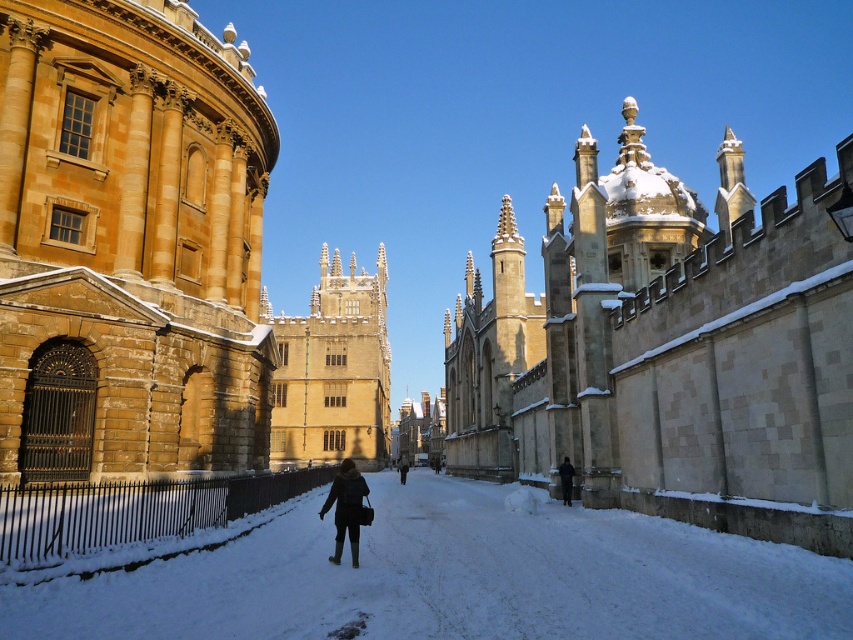
You are standing on the snow path in the winter scene and see two points marked on the image. Which point is closer to you, point (465,362) or point (357,513)?

Point (357,513) is closer to you because the description states that point (465,362) is further to the camera than point (357,513).

You are standing on the snow path and see the smooth stone wall at center and the dark brown coat at lower right. Which object is closer to your left side?

The dark brown coat at lower right is to the left of the smooth stone wall at center, so the dark brown coat at lower right is closer to your left side.